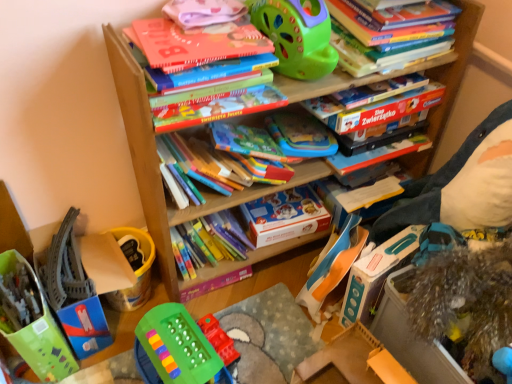
The height and width of the screenshot is (384, 512). Find the location of `free space above matte orange book at upper center, acting as the 2th book starting from the top (from a real-world perspective)`. free space above matte orange book at upper center, acting as the 2th book starting from the top (from a real-world perspective) is located at coordinates (200, 33).